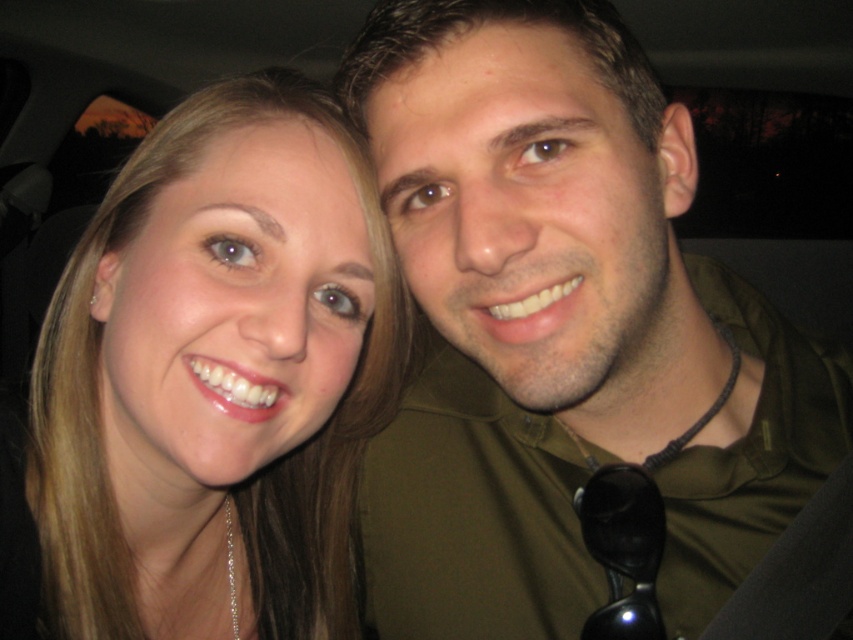
You are standing at the point marked as point (506, 248) in the image. The seatbelt strap is visible in the foreground. Can you reach the seatbelt strap without moving your position?

The point (506, 248) is 17.91 inches away from the viewer. Since the seatbelt strap is in the foreground, it is closer to the viewer than the point, so you cannot reach the seatbelt strap without moving your position.

You are a photographer trying to focus on the point at coordinates point (564, 330) in the image. Based on the scene description, what object is located at this point?

The point (564, 330) is on the matte green shirt at center, so the object located at this point is the matte green shirt at center.

You are designing a layout for a magazine cover and need to place two elements based on their sizes. The matte green shirt at center and the matte gold necklace at left must be arranged so that the larger item is on the right side of the page. Can you position them correctly?

The matte green shirt at center is larger than the matte gold necklace at left, so place the matte green shirt at center on the right side of the page and the matte gold necklace at left on the left side to follow the requirement.